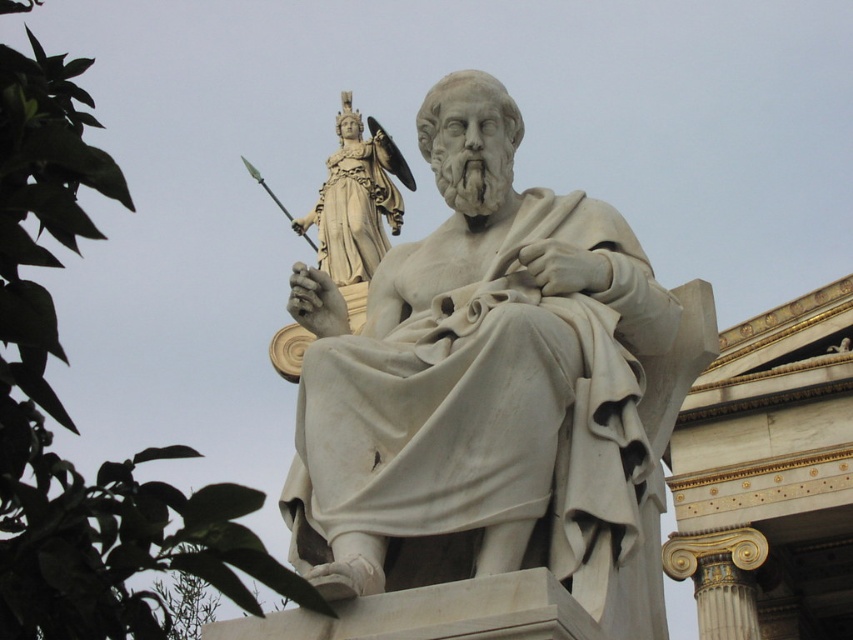
Consider the image. You are an archaeologist examining the image. You notice a point at coordinates (479, 381). Based on the scene, what object is this point most likely located on?

The point at coordinates (479, 381) is located on the white marble statue at center.

You are an archaeologist examining the classical marble statue of a seated figure and the background statue. You notice two points marked on the image at coordinates point (572, 564) and point (364, 170). Which point is closer to you as you face the statues?

Point (572, 564) is in front of point (364, 170), so it is closer to you as you face the statues.